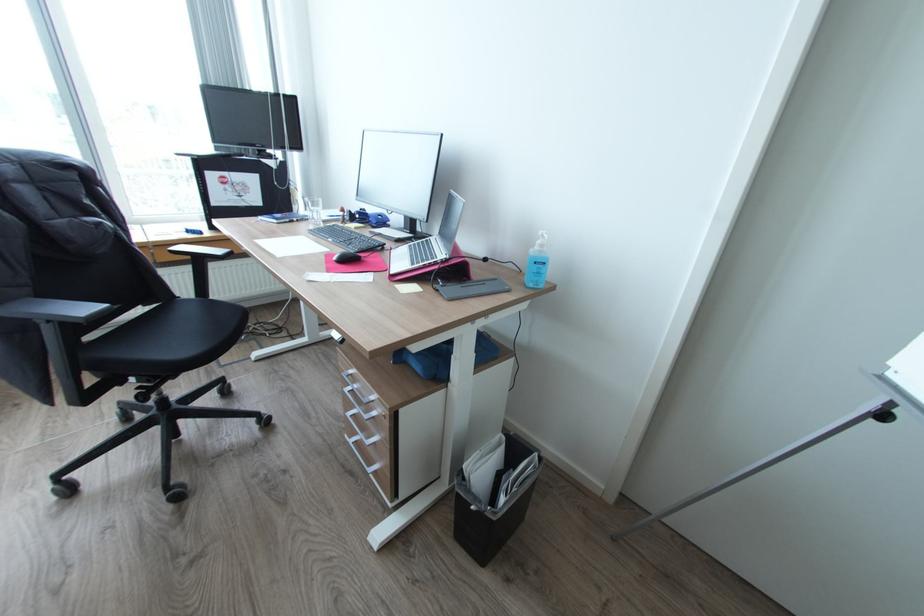
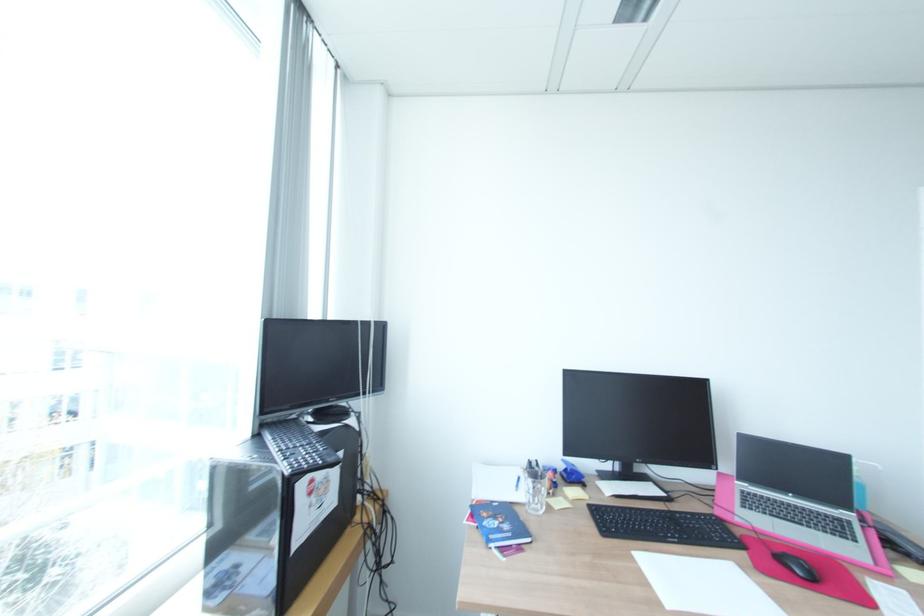
Find the pixel in the second image that matches [289,94] in the first image.

(381, 321)